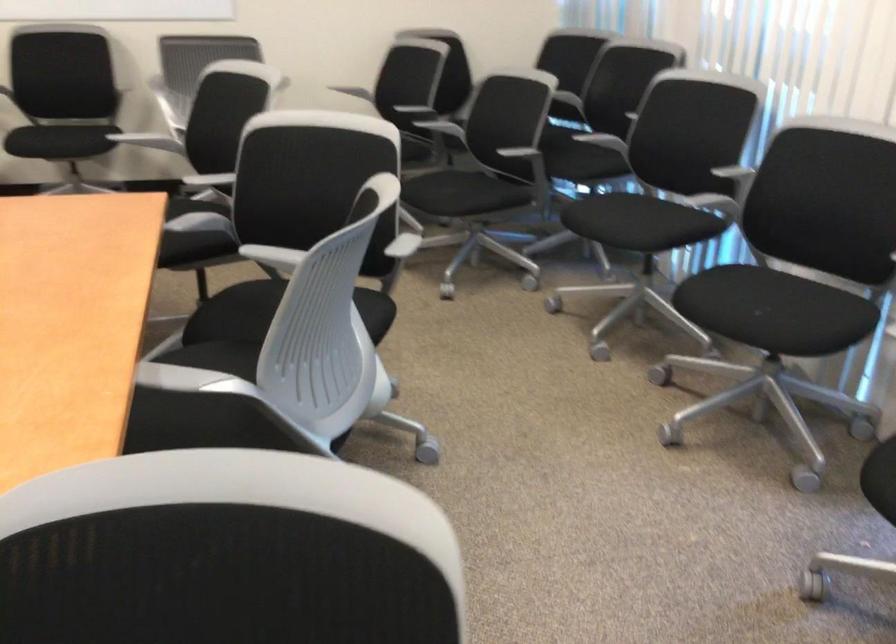
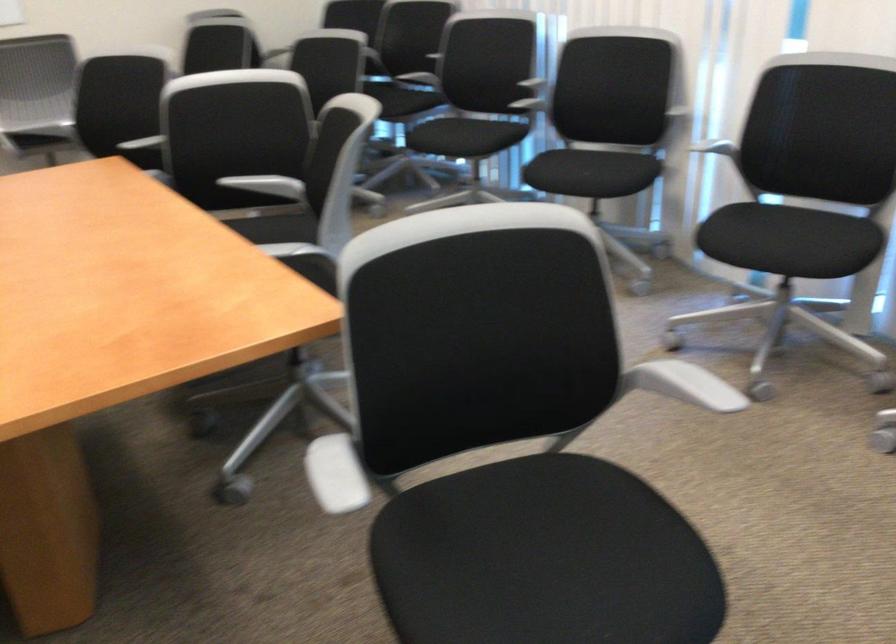
Question: I am providing you with two images of the same scene from different viewpoints. Please identify which objects are invisible in image2.

Choices:
 (A) chair sitting surface
 (B) black chair sitting surface
 (C) white chair armrest
 (D) long metal handle

Answer: (A)